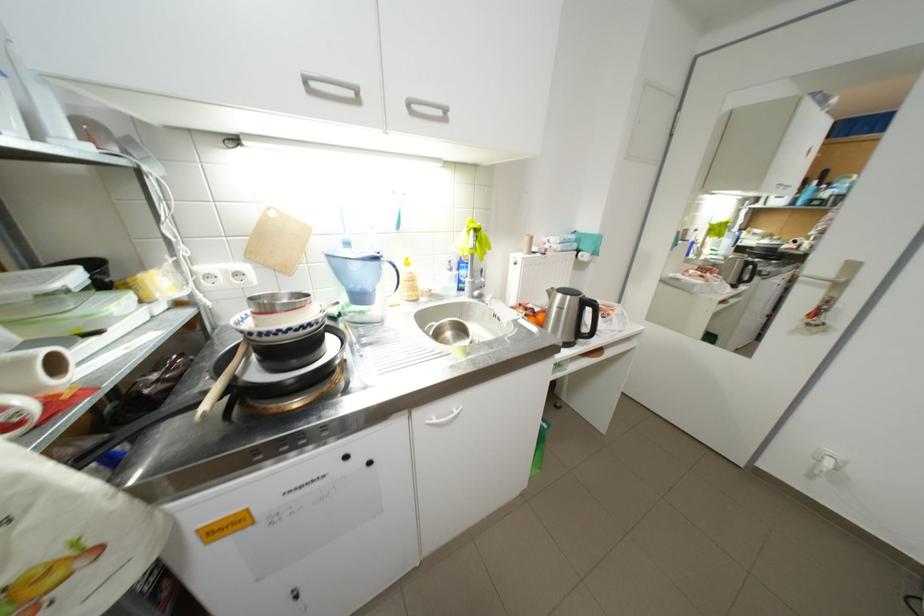
What do you see at coordinates (331, 87) in the screenshot? I see `the silver door handle` at bounding box center [331, 87].